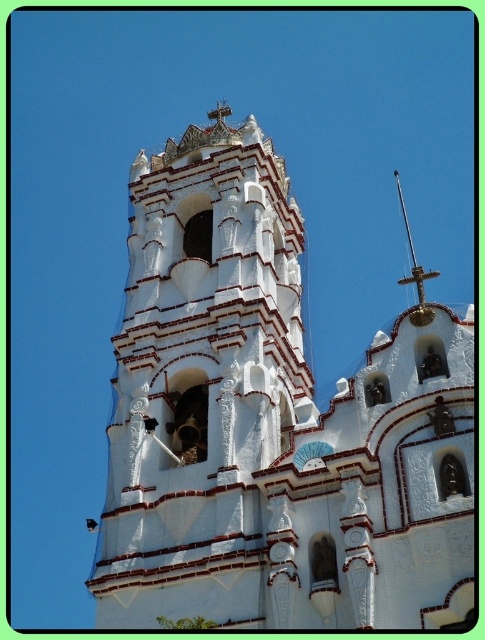
In the scene shown: You are a maintenance worker needing to reach the polished brass spire at upper right from the white stucco church at center. Given that your ladder can extend up to 10 meters, will you be able to reach it?

The distance between the white stucco church at center and the polished brass spire at upper right is 12.13 meters, which exceeds the ladder extension limit of 10 meters. Therefore, the ladder will not be sufficient to reach the polished brass spire at upper right.

You are standing in front of the church and want to take a photo of both the white stucco church at center and the polished brass spire at upper right. Which object should you frame first in your camera viewfinder to ensure both are captured in the shot?

The white stucco church at center is to the left of the polished brass spire at upper right, so you should frame the white stucco church at center first on the left side of the viewfinder and then adjust to include the polished brass spire at upper right on the right side.

You are standing in front of the white stucco church at center and want to take a photo of the polished brass spire at upper right. Since the spire is farther away, will you need to zoom in your camera to capture it clearly?

The white stucco church at center is closer to the viewer than the polished brass spire at upper right. To capture the distant spire clearly, you should zoom in your camera to focus on the polished brass spire at upper right.